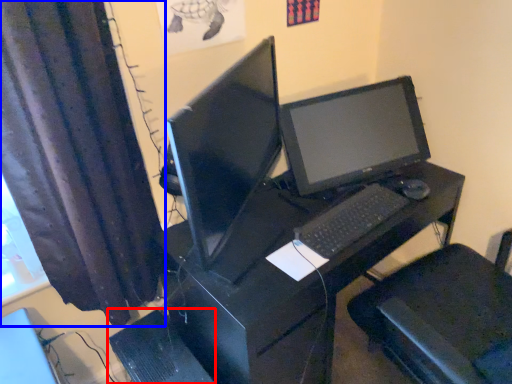
Question: Among these objects, which one is nearest to the camera, computer tower (highlighted by a red box) or curtain (highlighted by a blue box)?

Choices:
 (A) computer tower
 (B) curtain

Answer: (B)